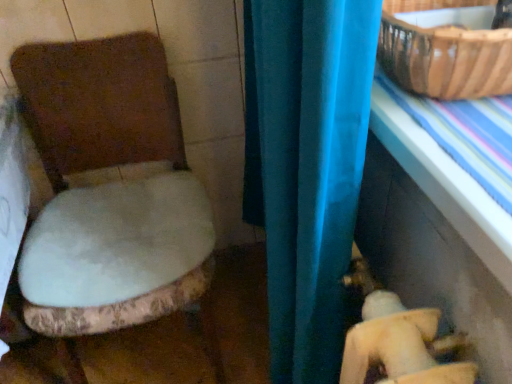
Question: Looking at their shapes, would you say brown woven basket at upper right is wider or thinner than white plush toilet seat at left?

Choices:
 (A) thin
 (B) wide

Answer: (A)

Question: Does point (462, 44) appear closer or farther from the camera than point (129, 49)?

Choices:
 (A) farther
 (B) closer

Answer: (B)

Question: Based on their relative distances, which object is farther from the blue plastic table at right?

Choices:
 (A) white plush toilet seat at left
 (B) brown woven basket at upper right

Answer: (A)

Question: Estimate the real-world distances between objects in this image. Which object is farther from the white plush toilet seat at left?

Choices:
 (A) brown woven basket at upper right
 (B) blue plastic table at right

Answer: (A)